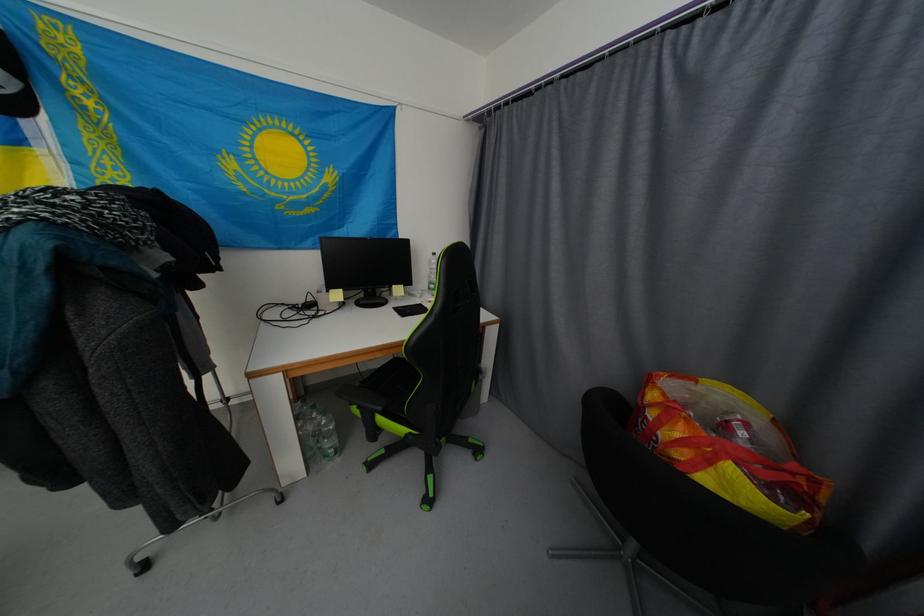
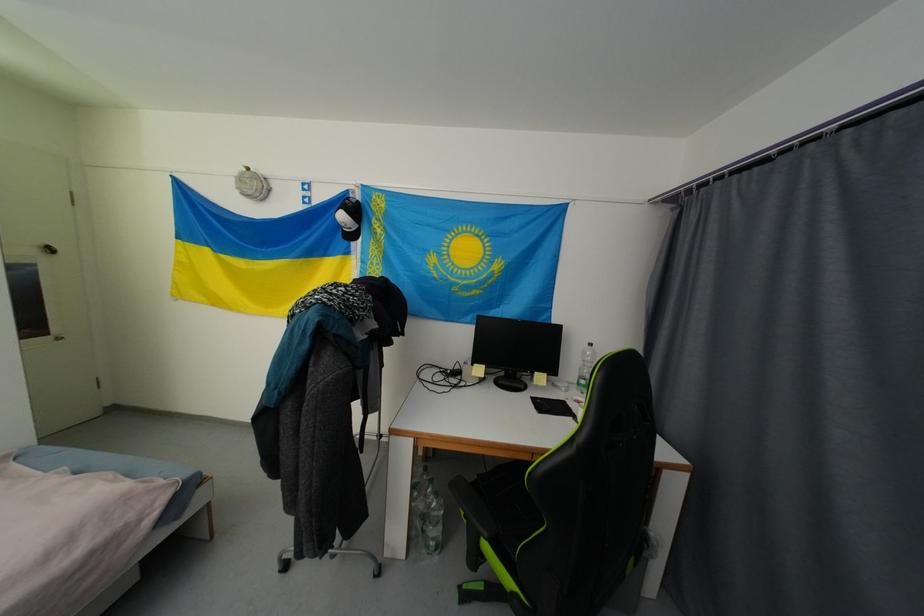
The point at [313,456] is marked in the first image. Where is the corresponding point in the second image?

(419, 535)